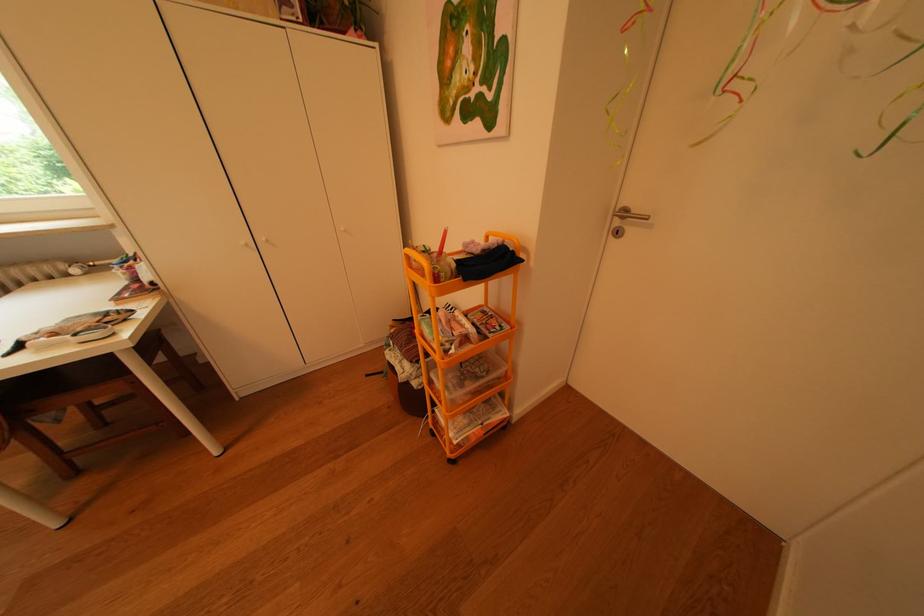
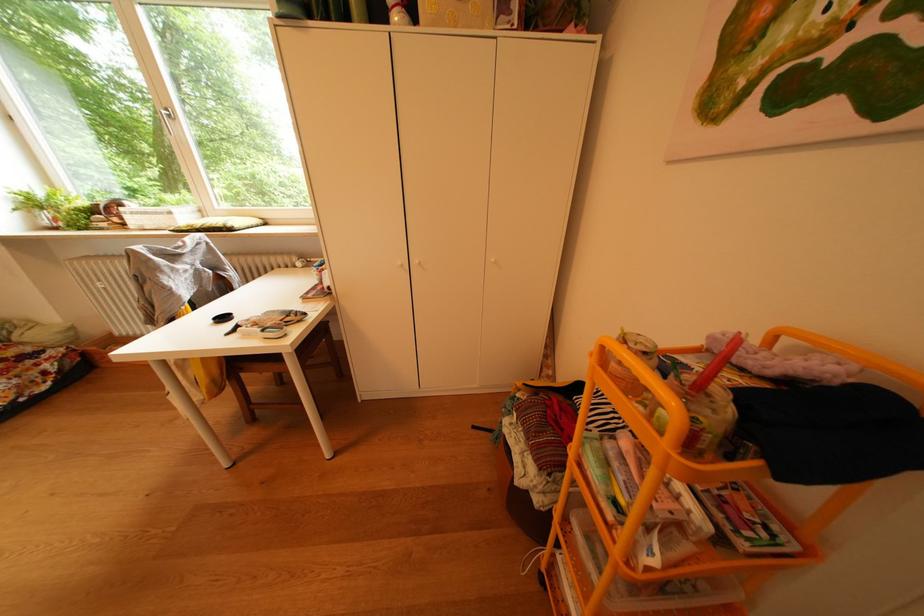
Question: The camera is either moving clockwise (left) or counter-clockwise (right) around the object. The first image is from the beginning of the video and the second image is from the end. Is the camera moving left or right when shooting the video?

Choices:
 (A) Left
 (B) Right

Answer: (B)